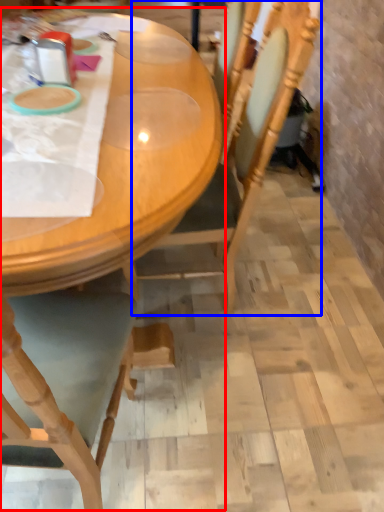
Question: Which object appears closest to the camera in this image, table (highlighted by a red box) or chair (highlighted by a blue box)?

Choices:
 (A) table
 (B) chair

Answer: (A)